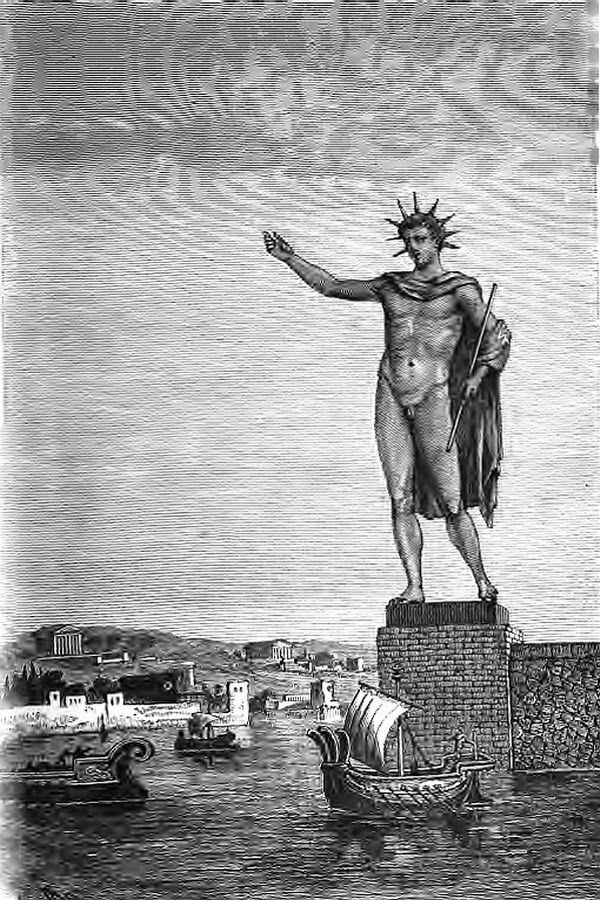
Identify the location of columns. This screenshot has width=600, height=900. (68, 645).